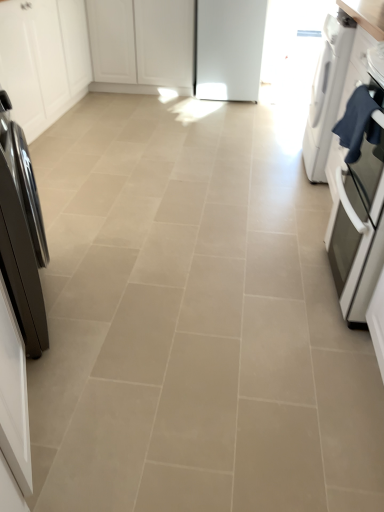
You are a GUI agent. You are given a task and a screenshot of the screen. Output one action in this format:
    pyautogui.click(x=<x>, y=<y>)
    Task: Click on the free spot below shiny black refrigerator at left, positioned as the 2th home appliance in top-to-bottom order (from a real-world perspective)
    
    Given the screenshot: What is the action you would take?
    (48, 301)